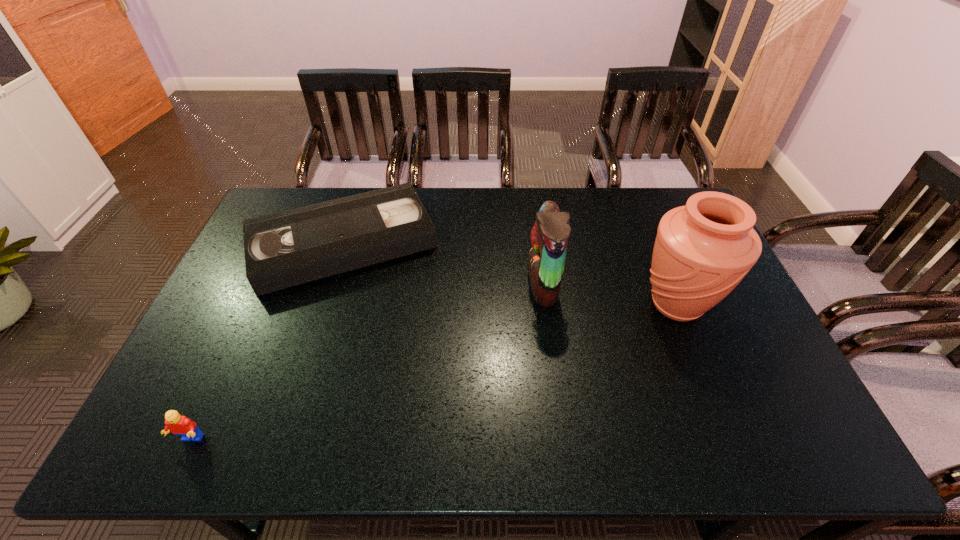
You are a GUI agent. You are given a task and a screenshot of the screen. Output one action in this format:
    pyautogui.click(x=<x>, y=<y>)
    Task: Click on the tallest object
    This screenshot has height=540, width=960.
    Given the screenshot: What is the action you would take?
    pyautogui.click(x=702, y=251)

Where is `vase`? Image resolution: width=960 pixels, height=540 pixels. vase is located at coordinates (702, 251).

Identify the location of parrot. The image size is (960, 540). (549, 237).

Locate an element on the screen. Image resolution: width=960 pixels, height=540 pixels. the third object from left to right is located at coordinates (549, 237).

This screenshot has height=540, width=960. I want to click on the nearest object, so click(180, 425).

Find the location of `Lego`. Lego is located at coordinates [180, 425].

The height and width of the screenshot is (540, 960). In order to click on the shortest object in this screenshot , I will do `click(288, 248)`.

Locate an element on the screen. The image size is (960, 540). vacant region located 0.240m on the back of the rightmost object is located at coordinates (645, 226).

Locate an element on the screen. The height and width of the screenshot is (540, 960). free space located at the face of the parrot is located at coordinates (509, 284).

Where is `free space located at the face of the parrot`? This screenshot has height=540, width=960. free space located at the face of the parrot is located at coordinates (509, 284).